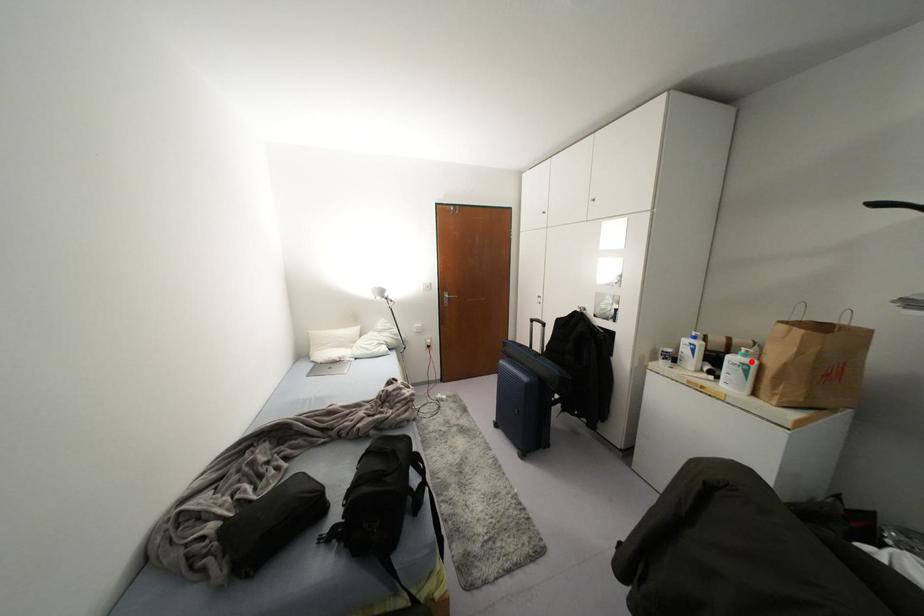
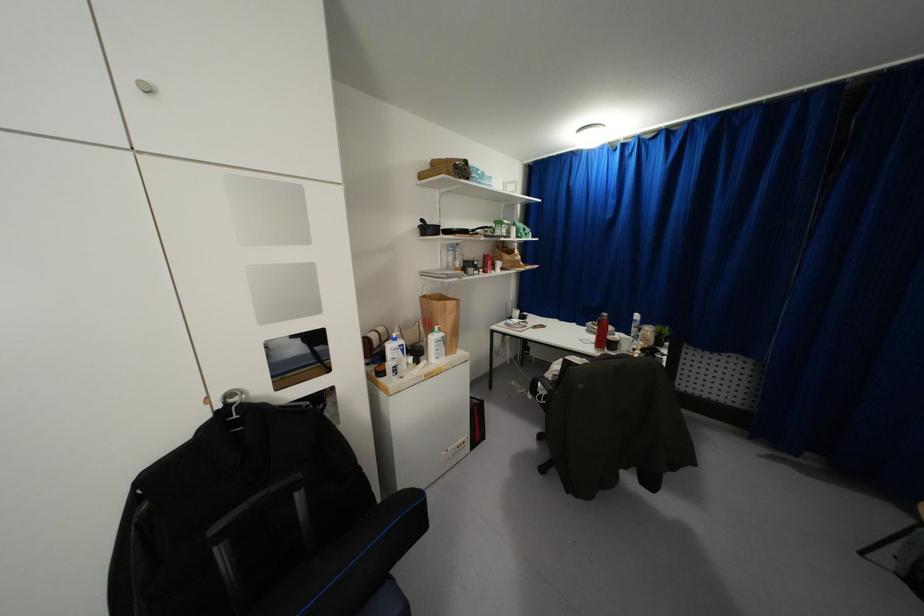
In the second image, find the point that corresponds to the highlighted location in the first image.

(442, 333)